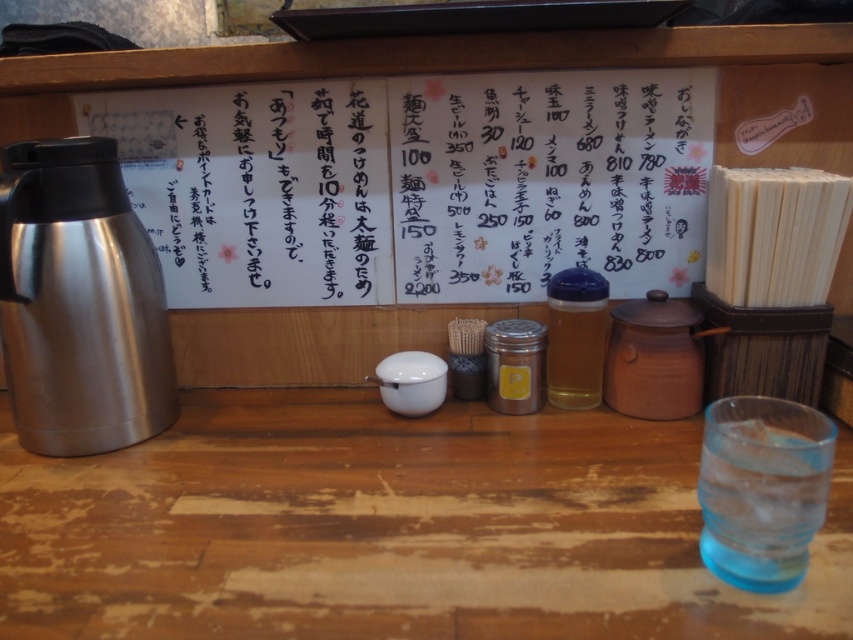
Between wooden table at center and shiny metallic thermos at left, which one is positioned higher?

Positioned higher is shiny metallic thermos at left.

Is point (123, 524) less distant than point (143, 364)?

Yes.

Who is more forward, (x=378, y=532) or (x=91, y=150)?

Point (x=378, y=532) is in front.

This screenshot has height=640, width=853. In order to click on wooden table at center in this screenshot , I will do [387, 529].

Which is below, white paper at center or translucent glass bottle at center?

translucent glass bottle at center is below.

Does white paper at center appear on the right side of translucent glass bottle at center?

No, white paper at center is not to the right of translucent glass bottle at center.

Measure the distance between point (466, 298) and camera.

90.71 centimeters

You are a GUI agent. You are given a task and a screenshot of the screen. Output one action in this format:
    pyautogui.click(x=<x>, y=<y>)
    Task: Click on the white paper at center
    The image size is (853, 640).
    Given the screenshot: What is the action you would take?
    (x=416, y=184)

Does point (113, 545) come closer to viewer compared to point (799, 497)?

No, (113, 545) is behind (799, 497).

Image resolution: width=853 pixels, height=640 pixels. What do you see at coordinates (387, 529) in the screenshot?
I see `wooden table at center` at bounding box center [387, 529].

Which is behind, point (624, 556) or point (746, 435)?

Positioned behind is point (746, 435).

The image size is (853, 640). In order to click on wooden table at center in this screenshot , I will do `click(387, 529)`.